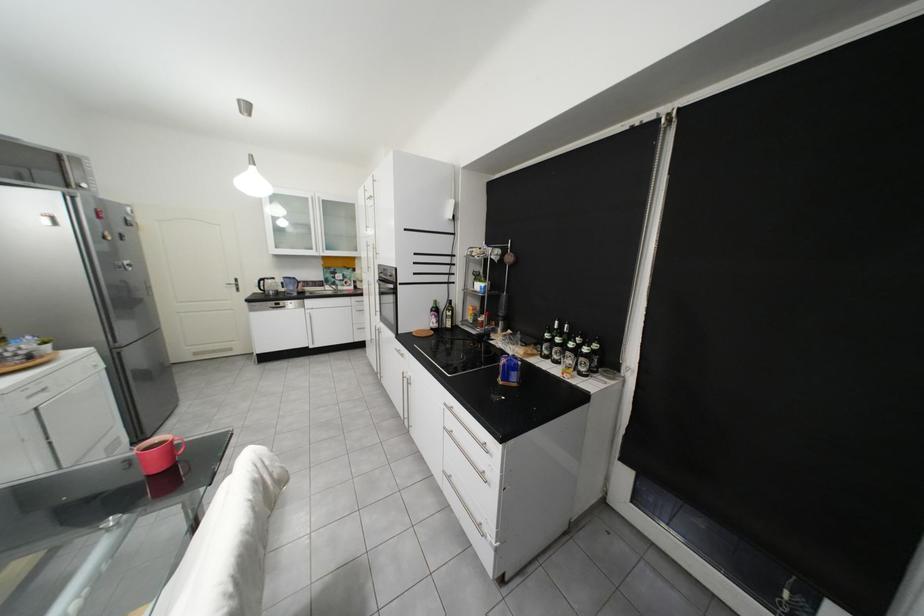
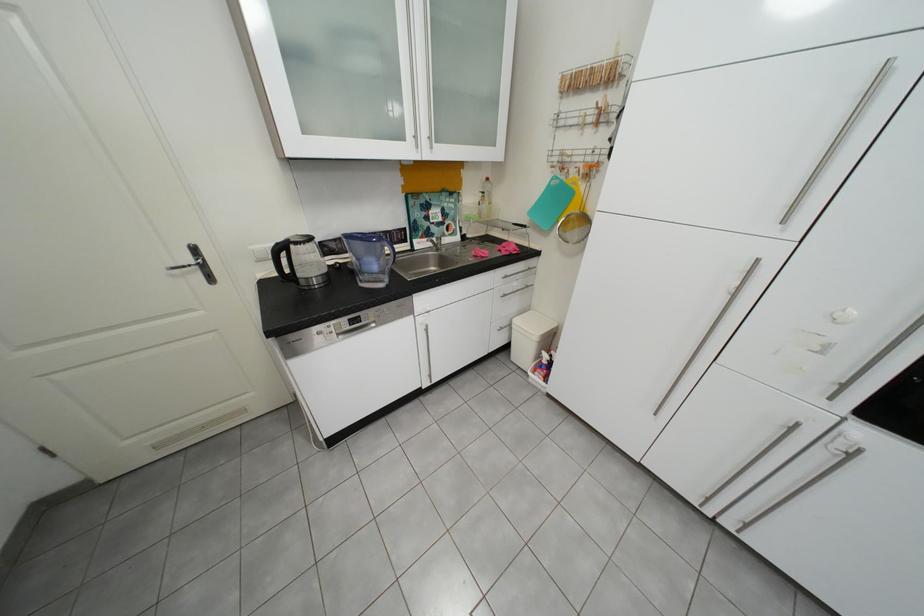
Which direction would the cameraman need to move to produce the second image?

The cameraman walked toward left, forward.